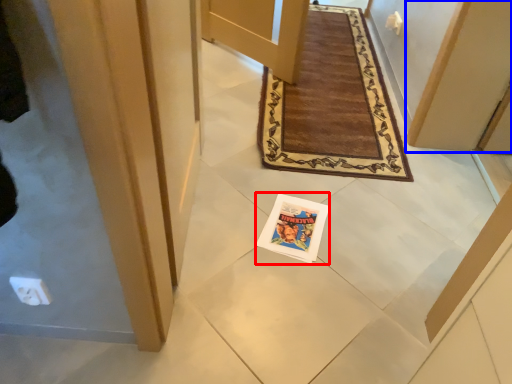
Question: Which object appears closest to the camera in this image, magazine (highlighted by a red box) or door (highlighted by a blue box)?

Choices:
 (A) magazine
 (B) door

Answer: (B)